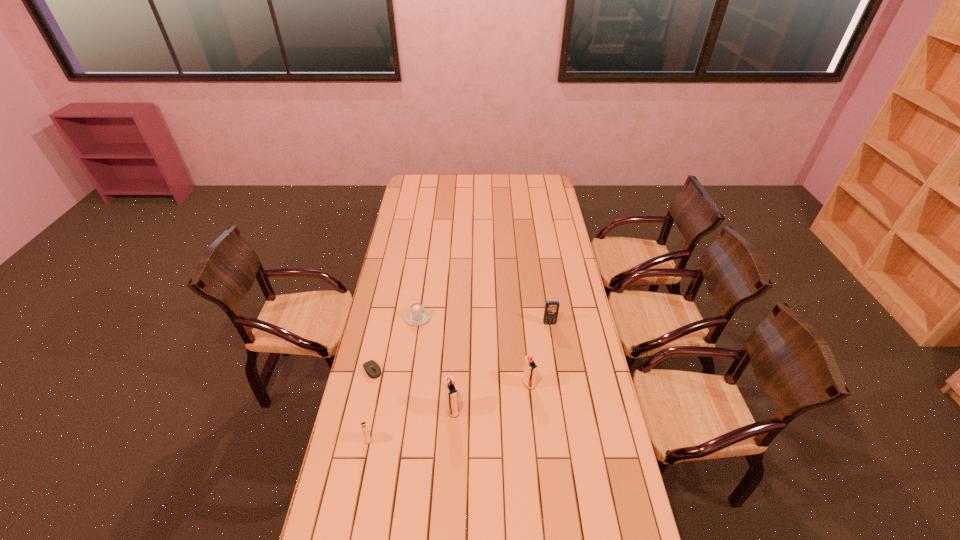
Locate an element on the screen. computer equipment present at the left edge is located at coordinates (373, 370).

You are a GUI agent. You are given a task and a screenshot of the screen. Output one action in this format:
    pyautogui.click(x=<x>, y=<y>)
    Task: Click on the object that is at the right edge
    
    Given the screenshot: What is the action you would take?
    pyautogui.click(x=551, y=310)

The image size is (960, 540). I want to click on vacant space at the far edge, so click(494, 190).

The width and height of the screenshot is (960, 540). Identify the location of free space at the left edge. (396, 239).

You are a GUI agent. You are given a task and a screenshot of the screen. Output one action in this format:
    pyautogui.click(x=<x>, y=<y>)
    Task: Click on the vacant space at the right edge
    The width and height of the screenshot is (960, 540).
    Given the screenshot: What is the action you would take?
    pyautogui.click(x=550, y=249)

The width and height of the screenshot is (960, 540). In the image, there is a desktop. What are the coordinates of `vacant space at the far right corner` in the screenshot? It's located at (545, 193).

In the image, there is a desktop. What are the coordinates of `vacant space at the near right corner` in the screenshot? It's located at (601, 530).

The image size is (960, 540). What are the coordinates of `unoccupied position between the leftmost igniter and the fourth object from right to left` in the screenshot? It's located at (393, 379).

The height and width of the screenshot is (540, 960). I want to click on free space between the nearest igniter and the second igniter from left to right, so click(x=410, y=425).

Locate an element on the screen. Image resolution: width=960 pixels, height=540 pixels. free spot between the third shortest object and the rightmost object is located at coordinates (459, 381).